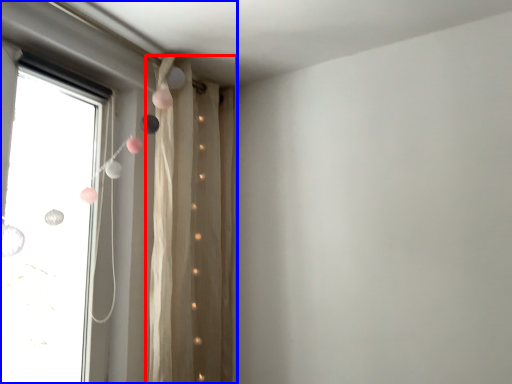
Question: Which object is closer to the camera taking this photo, curtain (highlighted by a red box) or window (highlighted by a blue box)?

Choices:
 (A) curtain
 (B) window

Answer: (B)